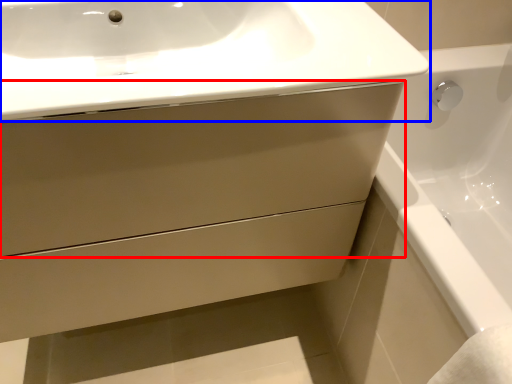
Question: Which point is further to the camera, drawer (highlighted by a red box) or sink (highlighted by a blue box)?

Choices:
 (A) drawer
 (B) sink

Answer: (A)